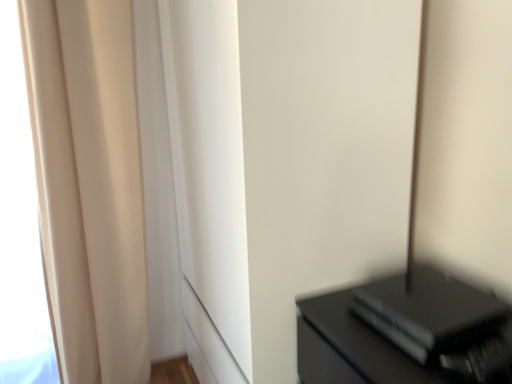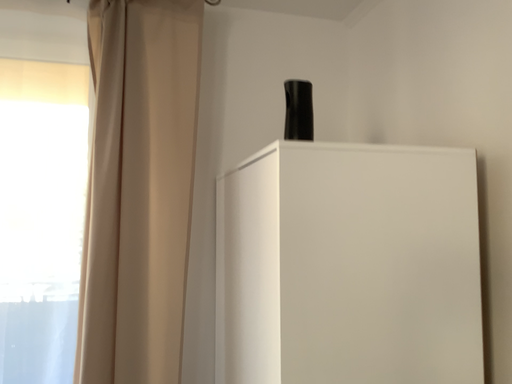
Question: How did the camera likely rotate when shooting the video?

Choices:
 (A) rotated upward
 (B) rotated downward

Answer: (A)